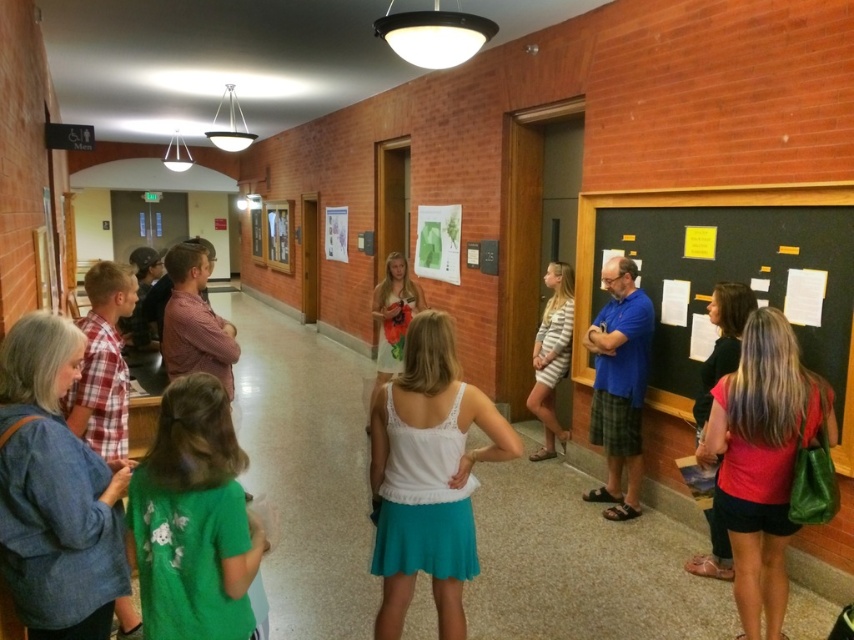
Is green cotton shirt at lower left below blue plaid shorts at center?

Yes, green cotton shirt at lower left is below blue plaid shorts at center.

Between green cotton shirt at lower left and blue plaid shorts at center, which one is positioned higher?

blue plaid shorts at center

Is point (230, 426) farther from camera compared to point (648, 304)?

No.

Locate an element on the screen. The image size is (854, 640). green cotton shirt at lower left is located at coordinates [x=192, y=520].

Which is in front, point (826, 438) or point (603, 307)?

Point (826, 438) is more forward.

Based on the photo, is matte red shirt at right smaller than blue plaid shorts at center?

Actually, matte red shirt at right might be larger than blue plaid shorts at center.

Measure the distance between point (769, 368) and camera.

A distance of 2.61 meters exists between point (769, 368) and camera.

In order to click on matte red shirt at right in this screenshot , I will do `click(762, 460)`.

Which of these two, blue plaid shorts at center or striped fabric dress at center, stands taller?

blue plaid shorts at center

Describe the element at coordinates (619, 385) in the screenshot. I see `blue plaid shorts at center` at that location.

You are a GUI agent. You are given a task and a screenshot of the screen. Output one action in this format:
    pyautogui.click(x=<x>, y=<y>)
    Task: Click on the blue plaid shorts at center
    
    Given the screenshot: What is the action you would take?
    pyautogui.click(x=619, y=385)